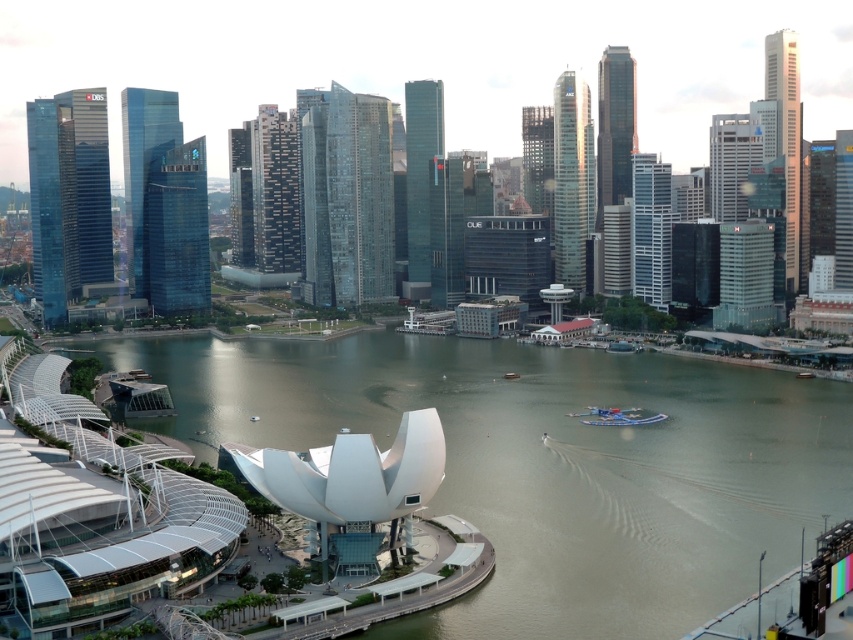
Can you confirm if greenish-gray water at center is shorter than metallic blue boat at center?

No.

Is point (497, 509) positioned before point (624, 412)?

Yes, point (497, 509) is closer to viewer.

Find the location of a particular element. Image resolution: width=853 pixels, height=640 pixels. greenish-gray water at center is located at coordinates (547, 464).